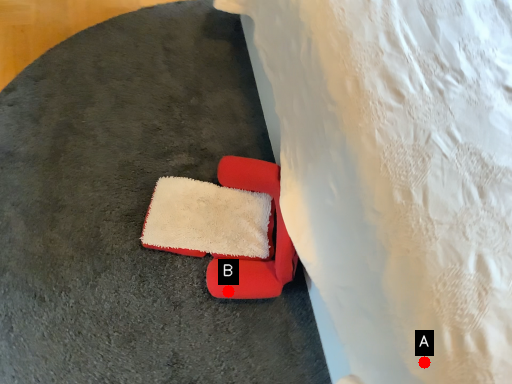
Question: Two points are circled on the image, labeled by A and B beside each circle. Among these points, which one is farthest from the camera?

Choices:
 (A) A is further
 (B) B is further

Answer: (B)